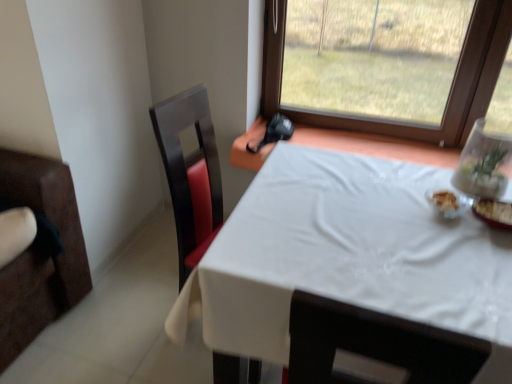
The height and width of the screenshot is (384, 512). Identify the location of unoccupied area behind white glossy bowl at upper right. (406, 188).